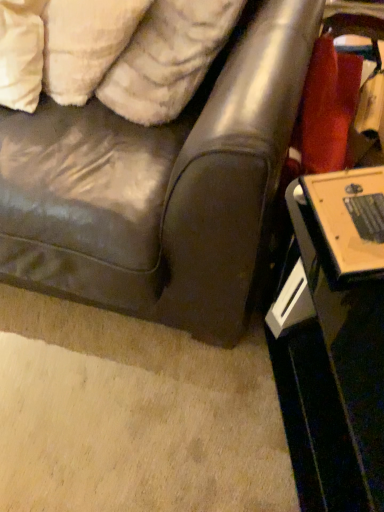
Question: Is white fluffy pillow at upper left, which is the 1th pillow in right-to-left order, shorter than black glossy table at lower right?

Choices:
 (A) yes
 (B) no

Answer: (A)

Question: Is white fluffy pillow at upper left, which is the 1th pillow in right-to-left order, in contact with black glossy table at lower right?

Choices:
 (A) yes
 (B) no

Answer: (B)

Question: Is white fluffy pillow at upper left, which is the 1th pillow in right-to-left order, smaller than black glossy table at lower right?

Choices:
 (A) no
 (B) yes

Answer: (B)

Question: Is black glossy table at lower right surrounded by white fluffy pillow at upper left, the second pillow from the left?

Choices:
 (A) yes
 (B) no

Answer: (B)

Question: From the image's perspective, does white fluffy pillow at upper left, which is the 1th pillow in right-to-left order, appear higher than black glossy table at lower right?

Choices:
 (A) yes
 (B) no

Answer: (A)

Question: Considering the positions of white fluffy pillow at upper left, the second pillow from the left, and white fluffy pillow at upper left, which ranks as the 2th pillow in right-to-left order, in the image, is white fluffy pillow at upper left, the second pillow from the left, taller or shorter than white fluffy pillow at upper left, which ranks as the 2th pillow in right-to-left order,?

Choices:
 (A) tall
 (B) short

Answer: (A)

Question: In the image, is white fluffy pillow at upper left, the second pillow from the left, positioned in front of or behind white fluffy pillow at upper left, which is the 1th pillow in left-to-right order?

Choices:
 (A) behind
 (B) front

Answer: (B)

Question: From a real-world perspective, is white fluffy pillow at upper left, the second pillow from the left, physically located above or below white fluffy pillow at upper left, which ranks as the 2th pillow in right-to-left order?

Choices:
 (A) above
 (B) below

Answer: (A)

Question: From the image's perspective, relative to white fluffy pillow at upper left, which is the 1th pillow in left-to-right order, is white fluffy pillow at upper left, which is the 1th pillow in right-to-left order, above or below?

Choices:
 (A) above
 (B) below

Answer: (B)

Question: Is leather couch at center taller or shorter than white fluffy pillow at upper left, which ranks as the 2th pillow in right-to-left order?

Choices:
 (A) tall
 (B) short

Answer: (A)

Question: From the image's perspective, is leather couch at center above or below white fluffy pillow at upper left, which ranks as the 2th pillow in right-to-left order?

Choices:
 (A) below
 (B) above

Answer: (A)

Question: From a real-world perspective, is leather couch at center above or below white fluffy pillow at upper left, which ranks as the 2th pillow in right-to-left order?

Choices:
 (A) above
 (B) below

Answer: (B)

Question: Would you say leather couch at center is to the left or to the right of white fluffy pillow at upper left, which is the 1th pillow in left-to-right order, in the picture?

Choices:
 (A) left
 (B) right

Answer: (A)

Question: In terms of width, does white fluffy pillow at upper left, which is the 1th pillow in right-to-left order, look wider or thinner when compared to leather couch at center?

Choices:
 (A) wide
 (B) thin

Answer: (B)

Question: In terms of height, does white fluffy pillow at upper left, which is the 1th pillow in right-to-left order, look taller or shorter compared to leather couch at center?

Choices:
 (A) short
 (B) tall

Answer: (A)